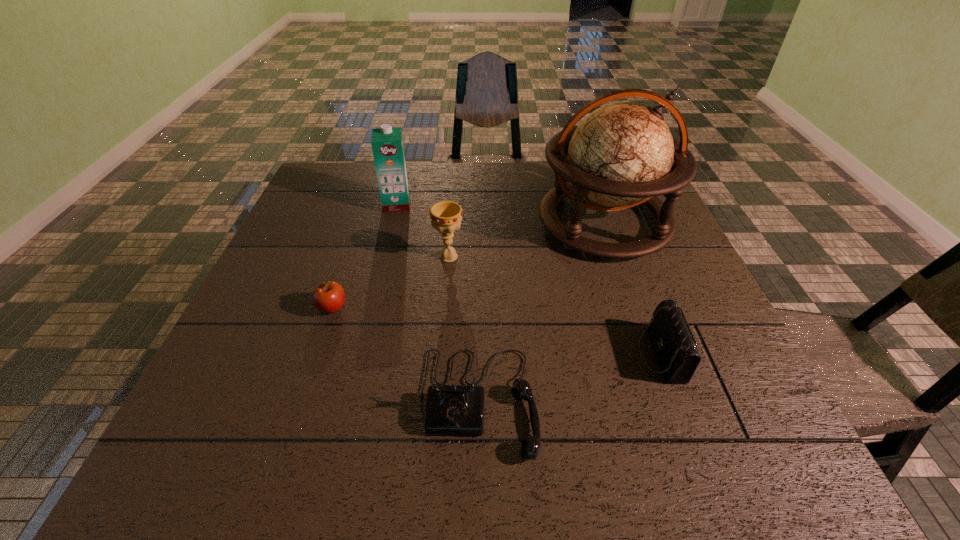
Where is `vacant area in the image that satisfies the following two spatial constraints: 1. on the front side of the globe; 2. on the right side of the fifth shortest object`? The image size is (960, 540). vacant area in the image that satisfies the following two spatial constraints: 1. on the front side of the globe; 2. on the right side of the fifth shortest object is located at coordinates (392, 223).

This screenshot has height=540, width=960. Identify the location of vacant space that satisfies the following two spatial constraints: 1. on the back side of the tallest object; 2. on the left side of the third nearest object. click(361, 223).

Find the location of a particular element. The image size is (960, 540). vacant area that satisfies the following two spatial constraints: 1. on the back side of the apple; 2. on the right side of the chalice is located at coordinates (349, 257).

Identify the location of vacant space that satisfies the following two spatial constraints: 1. on the back side of the globe; 2. on the right side of the fourth farthest object. (361, 223).

Where is `vacant space that satisfies the following two spatial constraints: 1. on the front flap of the clutch bag; 2. on the dial of the telephone`? The image size is (960, 540). vacant space that satisfies the following two spatial constraints: 1. on the front flap of the clutch bag; 2. on the dial of the telephone is located at coordinates (679, 402).